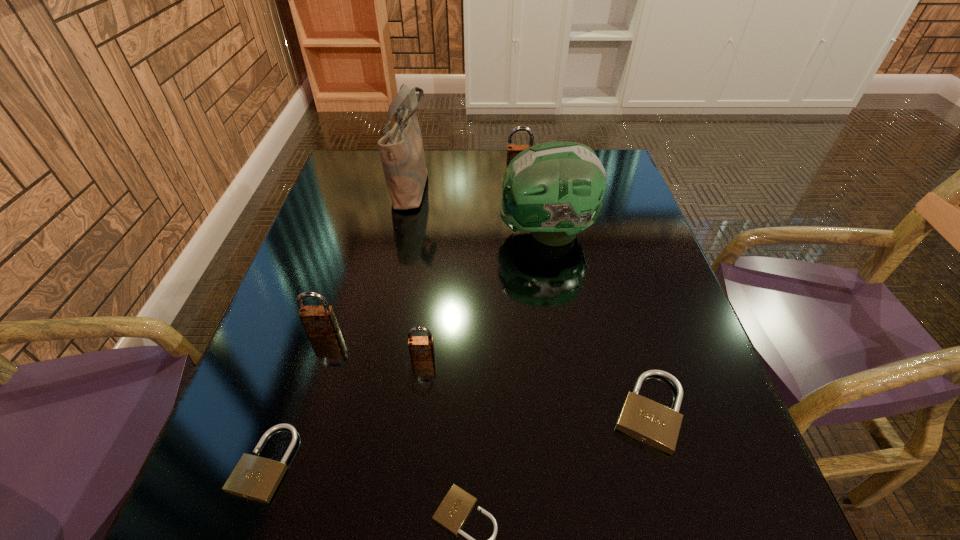
You are a GUI agent. You are given a task and a screenshot of the screen. Output one action in this format:
    pyautogui.click(x=<x>, y=<y>)
    Task: Click on the free space at the left edge of the desktop
    The height and width of the screenshot is (540, 960).
    Given the screenshot: What is the action you would take?
    pyautogui.click(x=277, y=399)

What are the coordinates of `vacant space at the right edge of the desktop` in the screenshot? It's located at coord(736,477).

You are a GUI agent. You are given a task and a screenshot of the screen. Output one action in this format:
    pyautogui.click(x=<x>, y=<y>)
    Task: Click on the free space between the rightmost beige padlock and the second tallest object
    
    Given the screenshot: What is the action you would take?
    pyautogui.click(x=597, y=322)

Locate an element on the screen. The height and width of the screenshot is (540, 960). blank region between the green football helmet and the fourth tallest padlock is located at coordinates (597, 322).

Where is `empty space that is in between the rightmost beige padlock and the football helmet`? Image resolution: width=960 pixels, height=540 pixels. empty space that is in between the rightmost beige padlock and the football helmet is located at coordinates (597, 322).

Locate an element on the screen. Image resolution: width=960 pixels, height=540 pixels. free area in between the rightmost beige padlock and the fourth object from left to right is located at coordinates (536, 384).

The height and width of the screenshot is (540, 960). I want to click on free space that is in between the second biggest brown padlock and the second shortest padlock, so click(x=295, y=398).

Identify the location of vacant area between the fifth shortest padlock and the tallest object. Image resolution: width=960 pixels, height=540 pixels. (368, 259).

I want to click on free space between the fifth farthest object and the second tallest padlock, so click(x=373, y=345).

I want to click on free area in between the fifth nearest object and the fourth shortest padlock, so click(x=373, y=345).